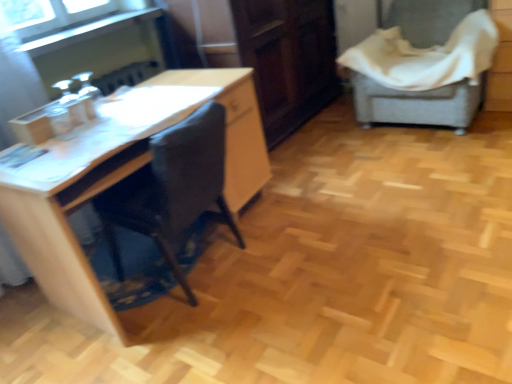
Where is `free location in front of wooden desk at left`? free location in front of wooden desk at left is located at coordinates (205, 337).